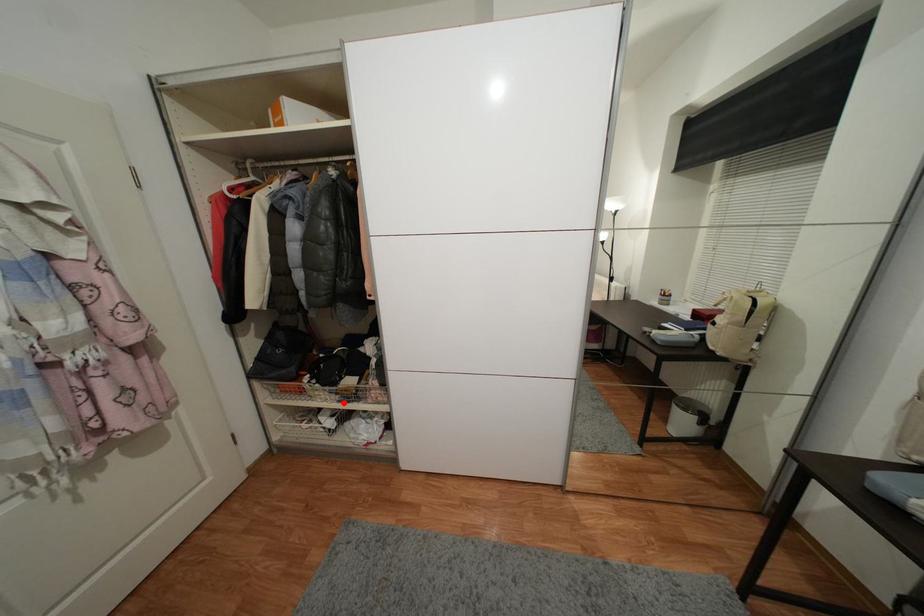
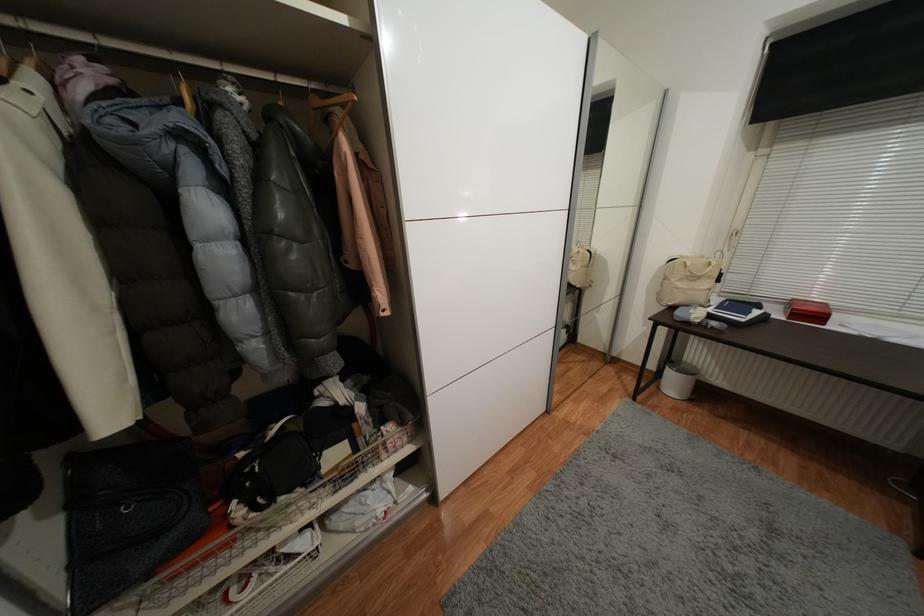
In the second image, find the point that corresponds to the highlighted location in the first image.

(342, 493)